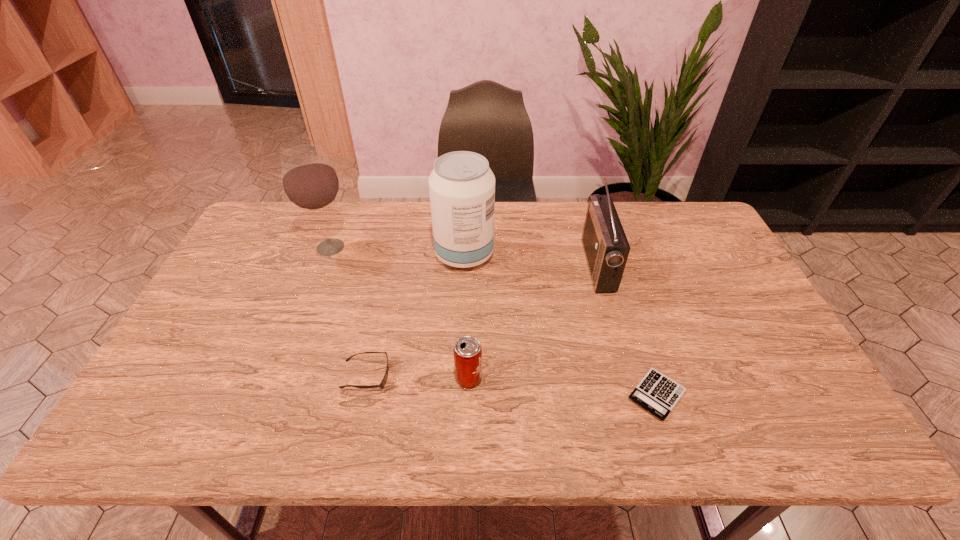
Locate an element on the screen. free point between the fifth object from right to left and the beer can is located at coordinates (418, 377).

You are a GUI agent. You are given a task and a screenshot of the screen. Output one action in this format:
    pyautogui.click(x=<x>, y=<y>)
    Task: Click on the empty location between the fourth tallest object and the calculator
    This screenshot has height=540, width=960.
    Given the screenshot: What is the action you would take?
    pyautogui.click(x=563, y=387)

Select which object appears as the third closest to the third shortest object. Please provide its 2D coordinates. Your answer should be formatted as a tuple, i.e. [(x, y)], where the tuple contains the x and y coordinates of a point satisfying the conditions above.

[(658, 394)]

Identify the location of object that is the fourth closest to the second object from left to right. (658, 394).

In order to click on blank area in the image that satisfies the following two spatial constraints: 1. on the front-facing side of the calculator; 2. on the left side of the fifth tallest object in this screenshot , I will do `click(362, 395)`.

Where is `vacant space that satisfies the following two spatial constraints: 1. on the front-facing side of the fifth tallest object; 2. on the left side of the beer can`? The height and width of the screenshot is (540, 960). vacant space that satisfies the following two spatial constraints: 1. on the front-facing side of the fifth tallest object; 2. on the left side of the beer can is located at coordinates (366, 379).

This screenshot has height=540, width=960. In order to click on vacant region that satisfies the following two spatial constraints: 1. on the front-facing side of the shortest object; 2. on the right side of the third tallest object in this screenshot , I will do `click(635, 395)`.

The height and width of the screenshot is (540, 960). I want to click on vacant region that satisfies the following two spatial constraints: 1. on the front side of the third shortest object; 2. on the right side of the left alcohol, so click(280, 379).